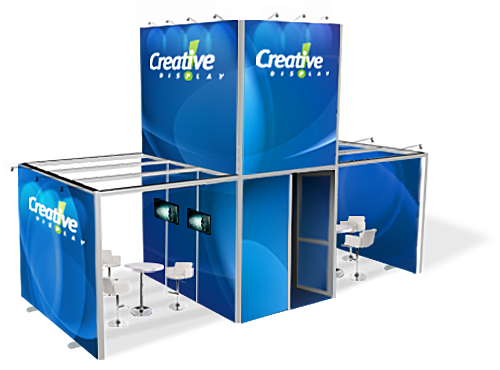
I want to click on table, so click(140, 267).